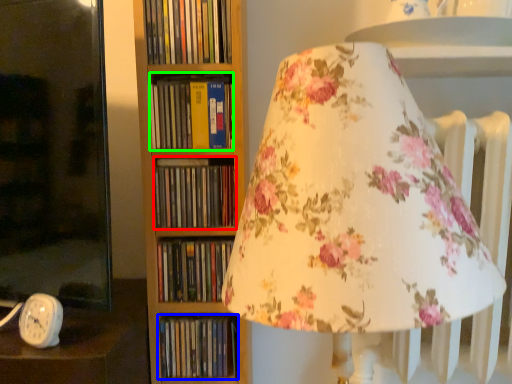
Question: Considering the real-world distances, which object is closest to book (highlighted by a red box)? book (highlighted by a blue box) or book (highlighted by a green box).

Choices:
 (A) book
 (B) book

Answer: (B)